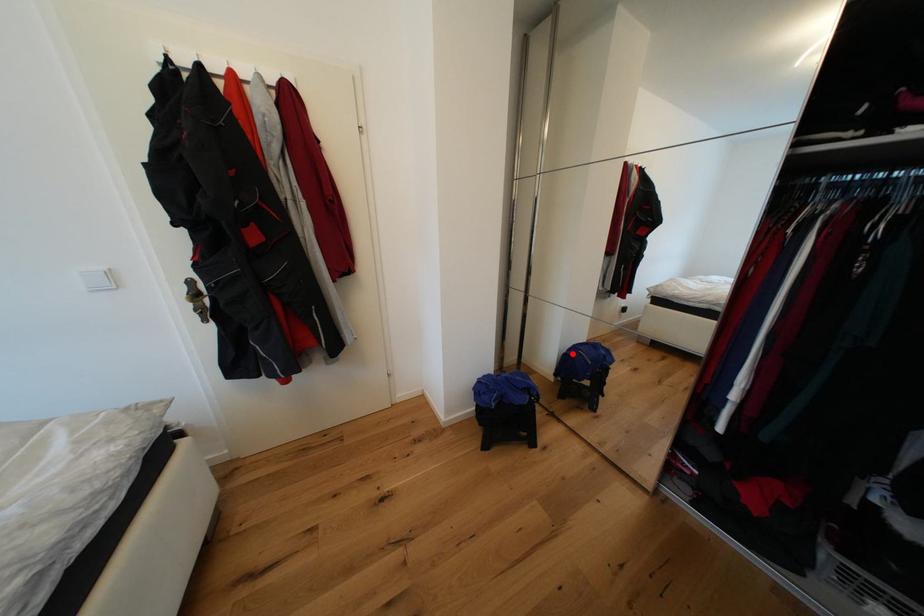
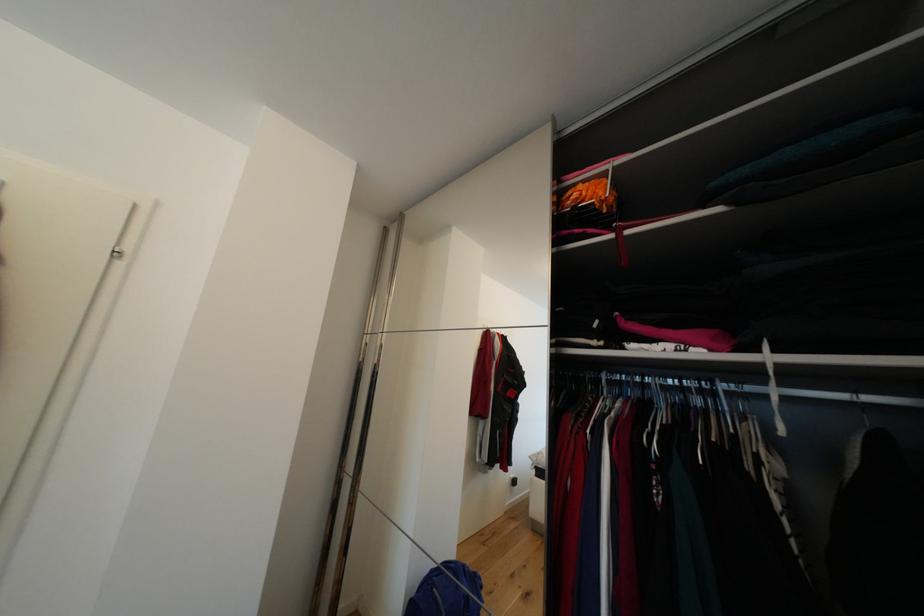
Where in the second image is the point corresponding to the highlighted location from the first image?

(421, 592)